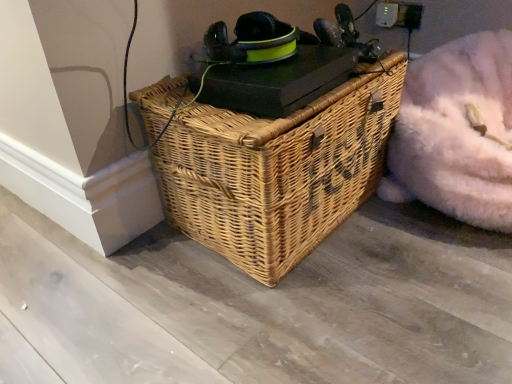
Question: From the image's perspective, would you say fluffy white bean bag at lower right is positioned over natural wicker picnic basket at center?

Choices:
 (A) yes
 (B) no

Answer: (A)

Question: Does fluffy white bean bag at lower right come behind natural wicker picnic basket at center?

Choices:
 (A) no
 (B) yes

Answer: (B)

Question: Can you confirm if fluffy white bean bag at lower right is wider than natural wicker picnic basket at center?

Choices:
 (A) no
 (B) yes

Answer: (B)

Question: Is fluffy white bean bag at lower right positioned far away from natural wicker picnic basket at center?

Choices:
 (A) yes
 (B) no

Answer: (B)

Question: From the image's perspective, is fluffy white bean bag at lower right under natural wicker picnic basket at center?

Choices:
 (A) no
 (B) yes

Answer: (A)

Question: Is fluffy white bean bag at lower right not inside natural wicker picnic basket at center?

Choices:
 (A) no
 (B) yes

Answer: (B)

Question: Considering the relative sizes of natural wicker picnic basket at center and fluffy white bean bag at lower right in the image provided, is natural wicker picnic basket at center bigger than fluffy white bean bag at lower right?

Choices:
 (A) no
 (B) yes

Answer: (B)

Question: Is the surface of natural wicker picnic basket at center in direct contact with fluffy white bean bag at lower right?

Choices:
 (A) yes
 (B) no

Answer: (B)

Question: Is natural wicker picnic basket at center in front of fluffy white bean bag at lower right?

Choices:
 (A) no
 (B) yes

Answer: (B)

Question: From a real-world perspective, is natural wicker picnic basket at center under fluffy white bean bag at lower right?

Choices:
 (A) yes
 (B) no

Answer: (B)

Question: From the image's perspective, is natural wicker picnic basket at center above fluffy white bean bag at lower right?

Choices:
 (A) yes
 (B) no

Answer: (B)

Question: Could fluffy white bean bag at lower right be considered to be inside natural wicker picnic basket at center?

Choices:
 (A) yes
 (B) no

Answer: (B)

Question: Considering the relative positions of fluffy white bean bag at lower right and natural wicker picnic basket at center in the image provided, is fluffy white bean bag at lower right to the left or to the right of natural wicker picnic basket at center?

Choices:
 (A) right
 (B) left

Answer: (A)